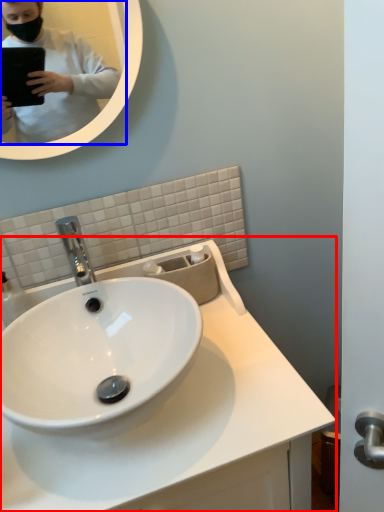
Question: Which of the following is the closest to the observer, sink (highlighted by a red box) or mirror (highlighted by a blue box)?

Choices:
 (A) sink
 (B) mirror

Answer: (A)